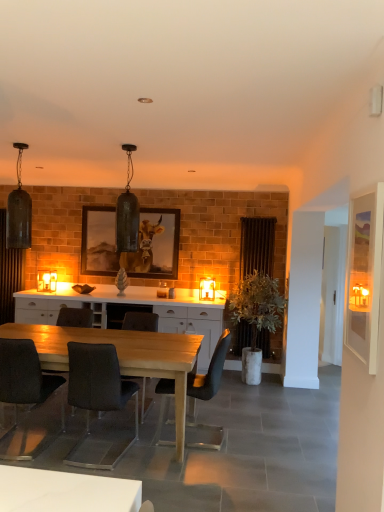
Locate an element on the screen. Image resolution: width=384 pixels, height=512 pixels. vacant location below metallic glass pendant light at center, which appears as the second lamp when viewed from the right (from a real-world perspective) is located at coordinates (130, 339).